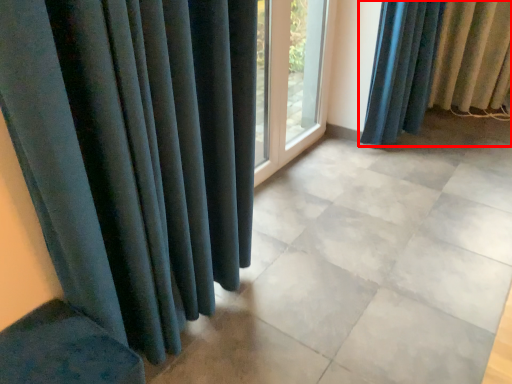
Question: In this image, where is curtain (annotated by the red box) located relative to window frame?

Choices:
 (A) left
 (B) right

Answer: (B)